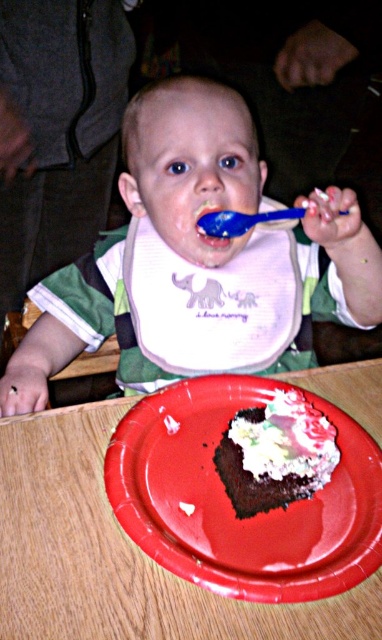
You are a parent trying to hand your child a juice box. The juice box is currently on the table 18.24 inches away from the smooth red paper plate at lower center. Can you estimate if the juice box is within a comfortable reaching distance for the child?

The juice box is 18.24 inches away from the smooth red paper plate at lower center. A typical comfortable reaching distance for a child at a table is around 12 to 15 inches. Therefore, the juice box may be slightly out of the childs comfortable reach and might require them to stretch or adjust their position to grab it.